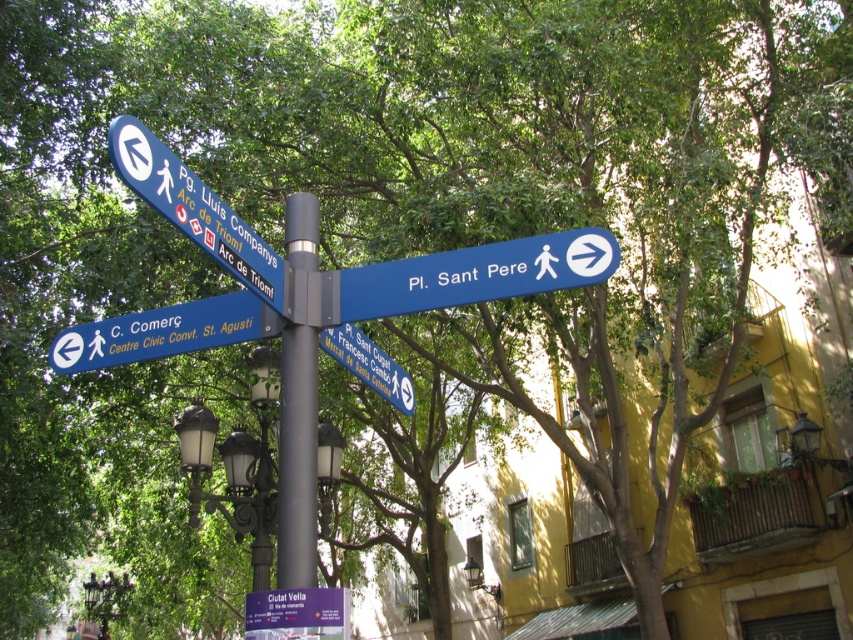
Does black metal pole at center have a larger size compared to blue plastic sign at left?

Correct, black metal pole at center is larger in size than blue plastic sign at left.

Is point (312, 410) farther from viewer compared to point (252, 326)?

No, (312, 410) is in front of (252, 326).

Is point (308, 490) closer to viewer compared to point (245, 316)?

Yes, point (308, 490) is closer to viewer.

In order to click on black metal pole at center in this screenshot , I will do `click(297, 458)`.

Between point (194, 305) and point (374, 346), which one is positioned in front?

Point (194, 305) is more forward.

Does point (260, 324) come closer to viewer compared to point (393, 397)?

Yes, it is.

In order to click on blue plastic sign at left in this screenshot , I will do `click(163, 332)`.

Is black metal pole at center above blue plastic sign at upper left?

Actually, black metal pole at center is below blue plastic sign at upper left.

Does black metal pole at center lie behind blue plastic sign at upper left?

Yes, black metal pole at center is behind blue plastic sign at upper left.

Is point (283, 444) in front of point (228, 209)?

No, (283, 444) is further to viewer.

Locate an element on the screen. black metal pole at center is located at coordinates (297, 458).